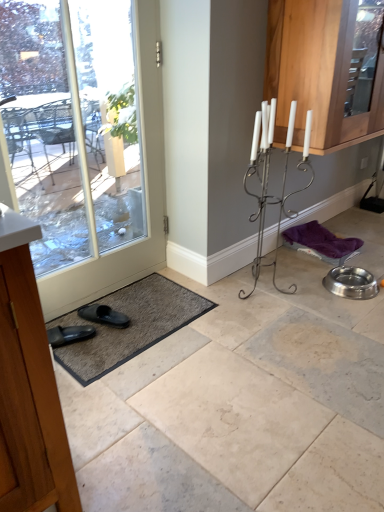
Question: Is gray textured bath mat at lower left smaller than clear glass door at lower left?

Choices:
 (A) no
 (B) yes

Answer: (B)

Question: Would you say gray textured bath mat at lower left contains clear glass door at lower left?

Choices:
 (A) yes
 (B) no

Answer: (B)

Question: Does gray textured bath mat at lower left have a larger size compared to clear glass door at lower left?

Choices:
 (A) no
 (B) yes

Answer: (A)

Question: Is the surface of gray textured bath mat at lower left in direct contact with clear glass door at lower left?

Choices:
 (A) no
 (B) yes

Answer: (A)

Question: Does gray textured bath mat at lower left have a lesser height compared to clear glass door at lower left?

Choices:
 (A) no
 (B) yes

Answer: (B)

Question: Is wooden cabinet at left, arranged as the 2th cabinetry when viewed from the right, in front of or behind black rubber slipper at lower left in the image?

Choices:
 (A) behind
 (B) front

Answer: (B)

Question: From the image's perspective, relative to black rubber slipper at lower left, is wooden cabinet at left, which appears as the second cabinetry when viewed from the top, above or below?

Choices:
 (A) above
 (B) below

Answer: (B)

Question: Is wooden cabinet at left, which appears as the second cabinetry when viewed from the top, bigger or smaller than black rubber slipper at lower left?

Choices:
 (A) small
 (B) big

Answer: (B)

Question: Considering the positions of point (1, 428) and point (84, 306), is point (1, 428) closer or farther from the camera than point (84, 306)?

Choices:
 (A) closer
 (B) farther

Answer: (A)

Question: Is point (87, 315) closer or farther from the camera than point (46, 290)?

Choices:
 (A) farther
 (B) closer

Answer: (A)

Question: From the image's perspective, is black rubber slipper at lower left above or below clear glass door at lower left?

Choices:
 (A) above
 (B) below

Answer: (B)

Question: Based on their positions, is black rubber slipper at lower left located to the left or right of clear glass door at lower left?

Choices:
 (A) left
 (B) right

Answer: (B)

Question: In terms of size, does black rubber slipper at lower left appear bigger or smaller than clear glass door at lower left?

Choices:
 (A) big
 (B) small

Answer: (B)

Question: Relative to clear glass door at lower left, is wooden cabinet at left, arranged as the 2th cabinetry when viewed from the right, in front or behind?

Choices:
 (A) front
 (B) behind

Answer: (A)

Question: Is wooden cabinet at left, which appears as the second cabinetry when viewed from the top, situated inside clear glass door at lower left or outside?

Choices:
 (A) outside
 (B) inside

Answer: (A)